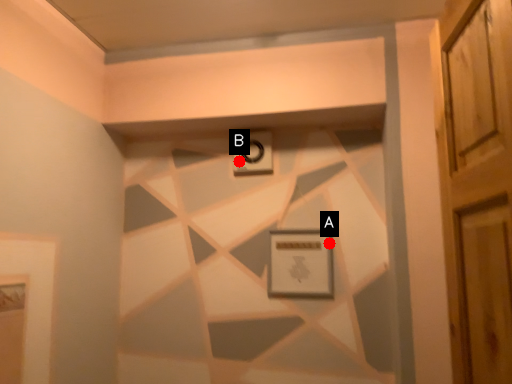
Question: Two points are circled on the image, labeled by A and B beside each circle. Which point is closer to the camera?

Choices:
 (A) A is closer
 (B) B is closer

Answer: (A)